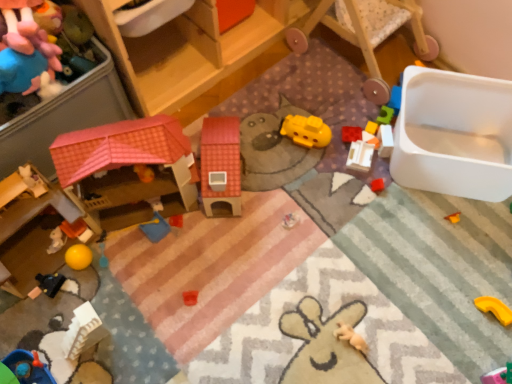
Image resolution: width=512 pixels, height=384 pixels. In order to click on vacant space that is in between white plastic blocks at right, which is the second toy in right-to-left order, and blue fabric toy at center, acting as the ninth toy starting from the right in this screenshot , I will do coord(266,191).